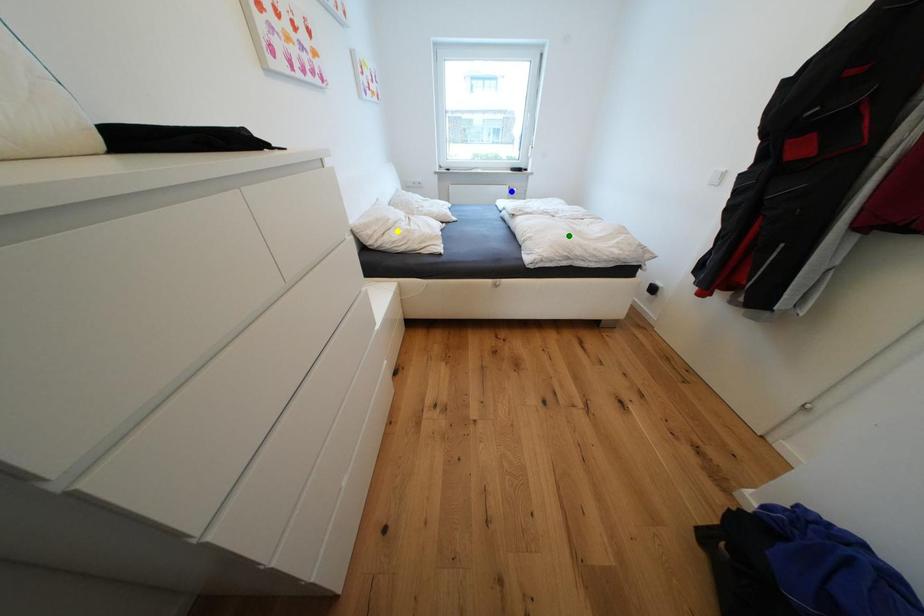
Order these from nearest to farthest:
blue point | yellow point | green point

green point → yellow point → blue point